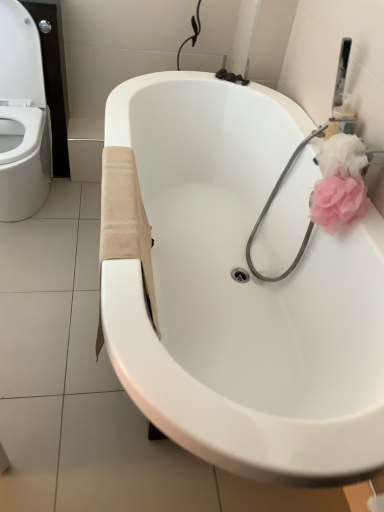
Question: In the image, is white glossy bathtub at center positioned in front of or behind pink fabric rose at right?

Choices:
 (A) behind
 (B) front

Answer: (B)

Question: Based on their sizes in the image, would you say white glossy bathtub at center is bigger or smaller than pink fabric rose at right?

Choices:
 (A) big
 (B) small

Answer: (A)

Question: Would you say white glossy bathtub at center is to the left or to the right of pink fabric rose at right in the picture?

Choices:
 (A) left
 (B) right

Answer: (A)

Question: Considering the positions of point (327, 202) and point (195, 165), is point (327, 202) closer or farther from the camera than point (195, 165)?

Choices:
 (A) closer
 (B) farther

Answer: (A)

Question: Would you say pink fabric rose at right is to the left or to the right of white glossy bathtub at center in the picture?

Choices:
 (A) left
 (B) right

Answer: (B)

Question: Considering the positions of pink fabric rose at right and white glossy bathtub at center in the image, is pink fabric rose at right taller or shorter than white glossy bathtub at center?

Choices:
 (A) tall
 (B) short

Answer: (B)

Question: Is pink fabric rose at right in front of or behind white glossy bathtub at center in the image?

Choices:
 (A) behind
 (B) front

Answer: (A)